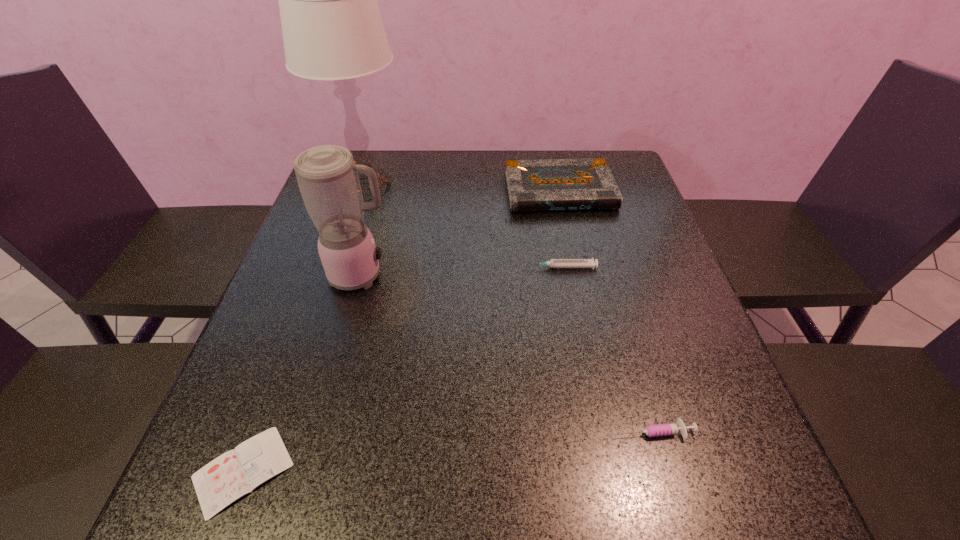
You are a GUI agent. You are given a task and a screenshot of the screen. Output one action in this format:
    pyautogui.click(x=<x>, y=<y>)
    Task: Click on the vacant space located 0.290m at the needle end of the farther syringe
    The image size is (960, 540).
    Given the screenshot: What is the action you would take?
    pyautogui.click(x=401, y=267)

Find the location of a particular element. Image resolution: width=960 pixels, height=540 pixels. free space located 0.100m at the needle end of the farther syringe is located at coordinates (484, 267).

What are the coordinates of `free region located 0.070m on the right of the nearer syringe` in the screenshot? It's located at (735, 431).

This screenshot has height=540, width=960. I want to click on vacant space located 0.240m on the back of the diary, so click(300, 318).

Where is `table lamp positioned at the far edge`? table lamp positioned at the far edge is located at coordinates (332, 29).

Locate an element on the screen. The image size is (960, 540). notebook situated at the far edge is located at coordinates (559, 184).

Identify the location of object located in the near edge section of the desktop. This screenshot has width=960, height=540. (237, 472).

This screenshot has height=540, width=960. Find the location of `table lamp at the left edge`. table lamp at the left edge is located at coordinates (332, 29).

Find the location of a particular element. food processor that is positioned at the left edge is located at coordinates (327, 176).

Find the location of `diary located at the left edge`. diary located at the left edge is located at coordinates (237, 472).